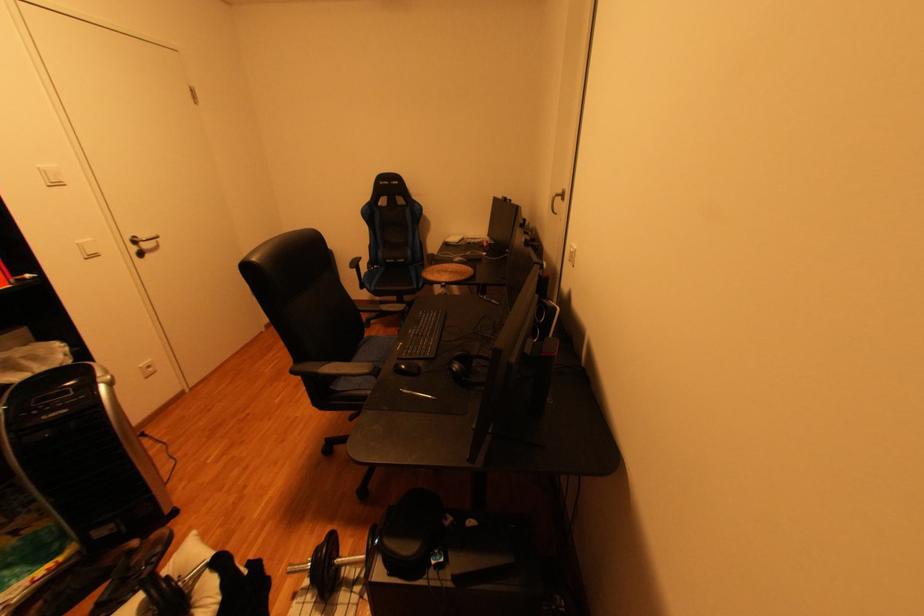
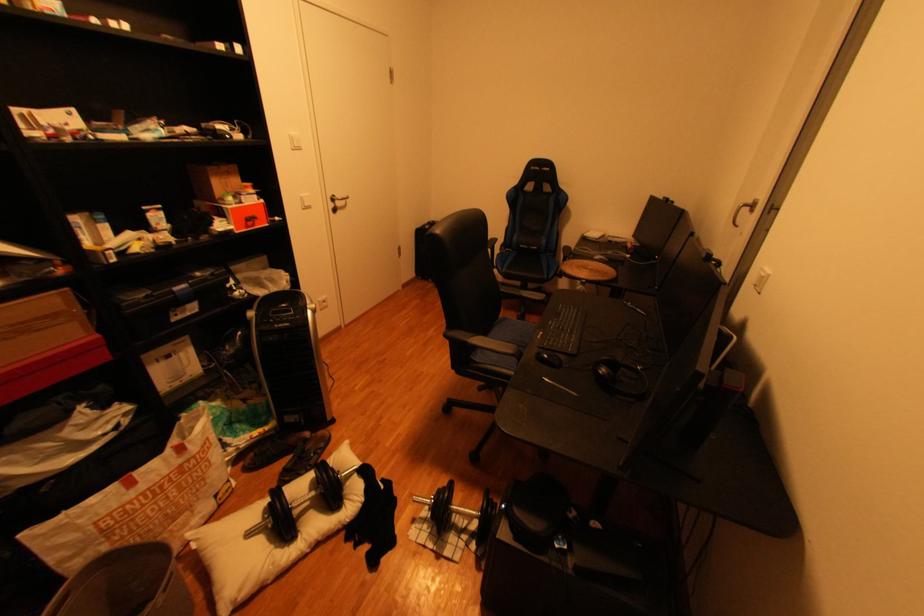
The point at (147,588) is marked in the first image. Where is the corresponding point in the second image?

(318, 468)